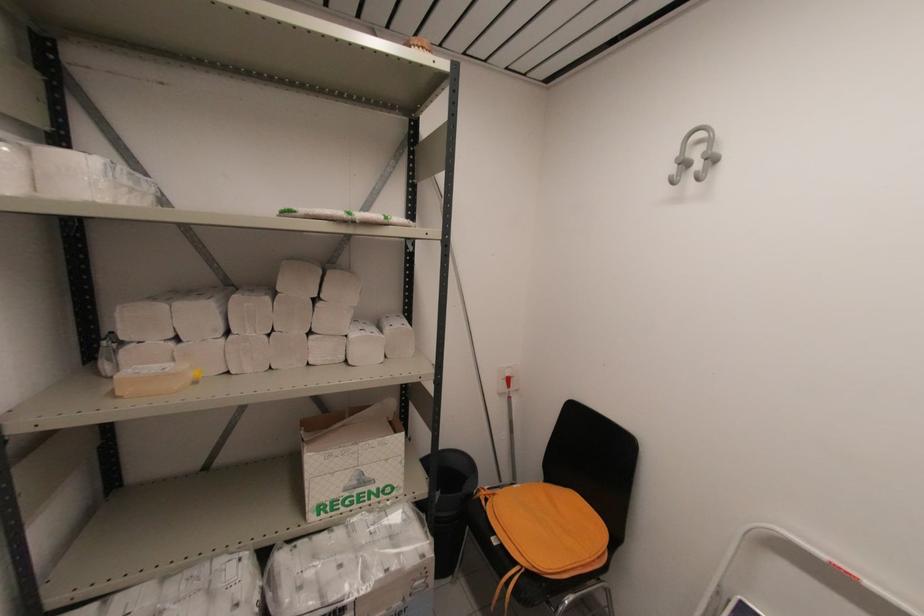
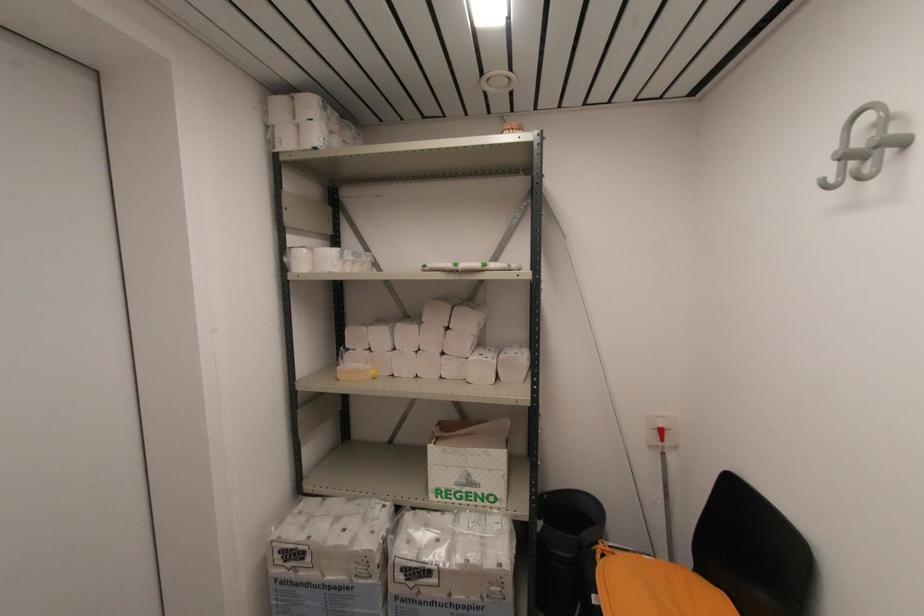
In the second image, find the point that corresponds to [509,387] in the first image.

(663, 439)